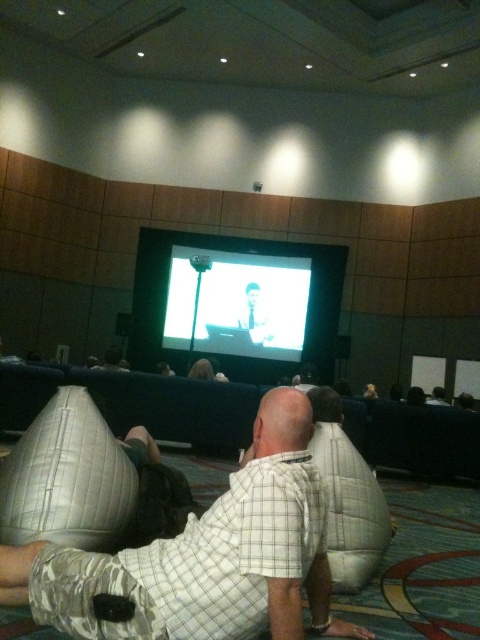
Between white checkered shirt at center and light brown suit at center, which one has less height?

white checkered shirt at center is shorter.

This screenshot has height=640, width=480. In order to click on white checkered shirt at center in this screenshot , I will do `click(205, 556)`.

Is white checkered shirt at center further to camera compared to matte white screen at center?

No, it is not.

Does point (239, 529) come in front of point (192, 250)?

Yes, it is.

Locate an element on the screen. The width and height of the screenshot is (480, 640). white checkered shirt at center is located at coordinates (205, 556).

Does point (279, 356) lie behind point (269, 332)?

Yes, point (279, 356) is behind point (269, 332).

Does point (217, 314) come closer to viewer compared to point (250, 312)?

No, it is behind (250, 312).

The height and width of the screenshot is (640, 480). Describe the element at coordinates (238, 304) in the screenshot. I see `matte white screen at center` at that location.

Identify the location of matte white screen at center. (238, 304).